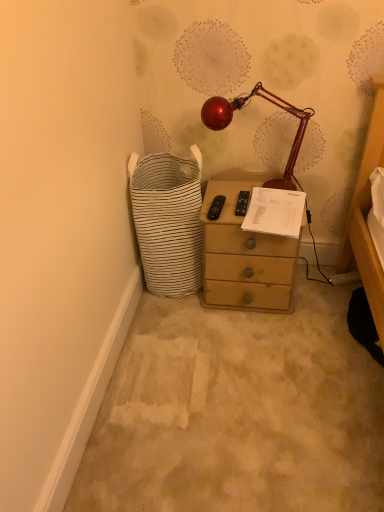
Identify the location of vacant area that lies in front of white striped fabric basket at lower left. (181, 334).